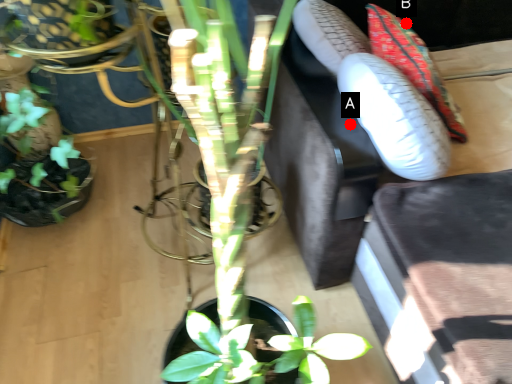
Question: Two points are circled on the image, labeled by A and B beside each circle. Which point appears farthest from the camera in this image?

Choices:
 (A) A is further
 (B) B is further

Answer: (B)